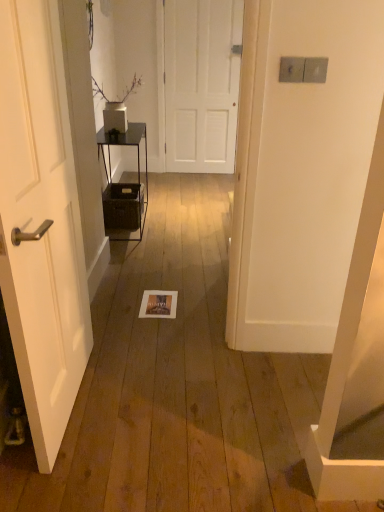
Question: Considering the relative sizes of white matte door at center, the 1th door from the top, and metallic black shelf at center in the image provided, is white matte door at center, the 1th door from the top, taller than metallic black shelf at center?

Choices:
 (A) no
 (B) yes

Answer: (B)

Question: Considering the relative sizes of white matte door at center, marked as the second door in a front-to-back arrangement, and metallic black shelf at center in the image provided, is white matte door at center, marked as the second door in a front-to-back arrangement, thinner than metallic black shelf at center?

Choices:
 (A) no
 (B) yes

Answer: (B)

Question: Is white matte door at center, the 2th door positioned from the bottom, wider than metallic black shelf at center?

Choices:
 (A) yes
 (B) no

Answer: (B)

Question: Is white matte door at center, which is the 2th door from left to right, in contact with metallic black shelf at center?

Choices:
 (A) no
 (B) yes

Answer: (A)

Question: Can you confirm if white matte door at center, marked as the second door in a front-to-back arrangement, is bigger than metallic black shelf at center?

Choices:
 (A) no
 (B) yes

Answer: (A)

Question: Is metallic black shelf at center wider or thinner than white matte door at left, the second door in the right-to-left sequence?

Choices:
 (A) thin
 (B) wide

Answer: (B)

Question: In terms of size, does metallic black shelf at center appear bigger or smaller than white matte door at left, the first door in the bottom-to-top sequence?

Choices:
 (A) big
 (B) small

Answer: (A)

Question: From their relative heights in the image, would you say metallic black shelf at center is taller or shorter than white matte door at left, the second door in the back-to-front sequence?

Choices:
 (A) tall
 (B) short

Answer: (B)

Question: Is point (130, 133) positioned closer to the camera than point (66, 324)?

Choices:
 (A) farther
 (B) closer

Answer: (A)

Question: Which is correct: white matte door at left, the second door in the back-to-front sequence, is inside white matte door at center, marked as the 1th door in a back-to-front arrangement, or outside of it?

Choices:
 (A) outside
 (B) inside

Answer: (A)

Question: In terms of width, does white matte door at left, the first door in the bottom-to-top sequence, look wider or thinner when compared to white matte door at center, marked as the 1th door in a back-to-front arrangement?

Choices:
 (A) wide
 (B) thin

Answer: (A)

Question: From the image's perspective, relative to white matte door at center, marked as the 1th door in a back-to-front arrangement, is white matte door at left, which is the first door from front to back, above or below?

Choices:
 (A) below
 (B) above

Answer: (A)

Question: Considering their positions, is white matte door at left, the first door in the bottom-to-top sequence, located in front of or behind white matte door at center, which is the 2th door from left to right?

Choices:
 (A) front
 (B) behind

Answer: (A)

Question: From the image's perspective, is white matte door at center, which is the 2th door from left to right, above or below metallic black shelf at center?

Choices:
 (A) below
 (B) above

Answer: (B)

Question: From a real-world perspective, is white matte door at center, marked as the 1th door in a back-to-front arrangement, above or below metallic black shelf at center?

Choices:
 (A) above
 (B) below

Answer: (A)